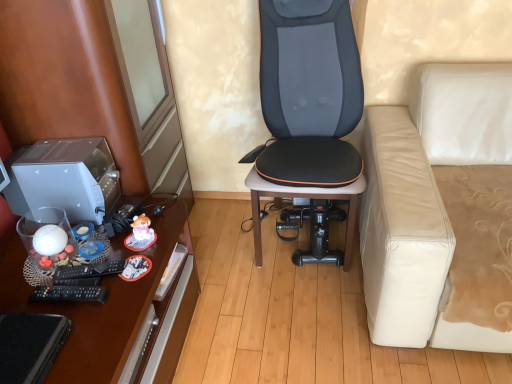
Measure the distance between brown wooden desk at left and camera.

The distance of brown wooden desk at left from camera is 1.01 meters.

Measure the distance between point (156, 333) and camera.

Point (156, 333) is 1.35 meters away from camera.

Measure the distance between brown wood dresser at left and camera.

brown wood dresser at left is 1.01 meters away from camera.

Locate an element on the screen. This screenshot has height=384, width=512. white leather couch at right is located at coordinates (426, 200).

This screenshot has width=512, height=384. What do you see at coordinates (426, 200) in the screenshot? I see `white leather couch at right` at bounding box center [426, 200].

I want to click on satin silver desktop at left, so click(x=65, y=178).

You are a GUI agent. You are given a task and a screenshot of the screen. Output one action in this format:
    pyautogui.click(x=<x>, y=<y>)
    Task: Click on the black leather chair at center
    
    Given the screenshot: What is the action you would take?
    pyautogui.click(x=309, y=116)

I want to click on brown wooden desk at left, so click(102, 305).

Consider the image. Is satin silver desktop at left facing away from brown wooden desk at left?

satin silver desktop at left is not turned away from brown wooden desk at left.

Is satin silver desktop at left next to brown wooden desk at left and touching it?

satin silver desktop at left and brown wooden desk at left are clearly separated.

Is satin silver desktop at left bigger or smaller than brown wooden desk at left?

Considering their sizes, satin silver desktop at left takes up less space than brown wooden desk at left.

Can you confirm if satin silver desktop at left is positioned to the left of brown wooden desk at left?

Correct, you'll find satin silver desktop at left to the left of brown wooden desk at left.

Is brown wood dresser at left looking in the opposite direction of brown wooden desk at left?

No, brown wooden desk at left is not at the back of brown wood dresser at left.

Between brown wood dresser at left and brown wooden desk at left, which one appears on the right side from the viewer's perspective?

brown wooden desk at left is more to the right.

Which of these two, brown wood dresser at left or brown wooden desk at left, stands shorter?

With less height is brown wooden desk at left.

Is brown wood dresser at left closer to the viewer compared to brown wooden desk at left?

That is False.

Does white leather couch at right appear on the left side of satin silver desktop at left?

Incorrect, white leather couch at right is not on the left side of satin silver desktop at left.

Is the position of white leather couch at right less distant than that of satin silver desktop at left?

Yes, white leather couch at right is in front of satin silver desktop at left.

You are a GUI agent. You are given a task and a screenshot of the screen. Output one action in this format:
    pyautogui.click(x=<x>, y=<y>)
    Task: Click on the desktop computer above the white leather couch at right (from the image's perspective)
    The height and width of the screenshot is (384, 512).
    Given the screenshot: What is the action you would take?
    coord(65,178)

Which object is wider, white leather couch at right or satin silver desktop at left?

With larger width is white leather couch at right.

Is brown wooden desk at left in front of or behind satin silver desktop at left in the image?

brown wooden desk at left is in front of satin silver desktop at left.

Based on the photo, how distant is brown wooden desk at left from satin silver desktop at left?

brown wooden desk at left is 10.54 inches away from satin silver desktop at left.

Is brown wooden desk at left at the left side of satin silver desktop at left?

No, brown wooden desk at left is not to the left of satin silver desktop at left.

Between brown wooden desk at left and satin silver desktop at left, which one has smaller size?

With smaller size is satin silver desktop at left.

Is black leather chair at center inside the boundaries of brown wooden desk at left, or outside?

black leather chair at center is spatially situated outside brown wooden desk at left.

Considering the relative sizes of black leather chair at center and brown wooden desk at left in the image provided, is black leather chair at center smaller than brown wooden desk at left?

Yes, black leather chair at center is smaller than brown wooden desk at left.

From a real-world perspective, which object rests below the other?

brown wooden desk at left.

Does satin silver desktop at left touch brown wood dresser at left?

No, satin silver desktop at left is not with brown wood dresser at left.

Considering the sizes of satin silver desktop at left and brown wood dresser at left in the image, is satin silver desktop at left taller or shorter than brown wood dresser at left?

Clearly, satin silver desktop at left is shorter compared to brown wood dresser at left.

Between satin silver desktop at left and brown wood dresser at left, which one has smaller size?

Smaller between the two is satin silver desktop at left.

The image size is (512, 384). In the image, there is a satin silver desktop at left. Find the location of `dresser below it (from a real-world perspective)`. dresser below it (from a real-world perspective) is located at coordinates (66, 81).

Consider the image. Can you confirm if white leather couch at right is taller than black leather chair at center?

No, white leather couch at right is not taller than black leather chair at center.

From the picture: Considering the relative sizes of white leather couch at right and black leather chair at center in the image provided, is white leather couch at right smaller than black leather chair at center?

Actually, white leather couch at right might be larger than black leather chair at center.

Which of these two, white leather couch at right or black leather chair at center, is wider?

Wider between the two is white leather couch at right.

Is white leather couch at right facing away from black leather chair at center?

No, white leather couch at right's orientation is not away from black leather chair at center.

Locate an element on the screen. desk that is in front of the satin silver desktop at left is located at coordinates (102, 305).

What are the coordinates of `desk on the right of brown wood dresser at left` in the screenshot? It's located at (102, 305).

Based on their spatial positions, is brown wooden desk at left or white leather couch at right closer to black leather chair at center?

white leather couch at right lies closer to black leather chair at center than the other object.

Which object lies nearer to the anchor point white leather couch at right, satin silver desktop at left or black leather chair at center?

Among the two, black leather chair at center is located nearer to white leather couch at right.

Considering their positions, is satin silver desktop at left positioned closer to brown wood dresser at left than black leather chair at center?

Based on the image, satin silver desktop at left appears to be nearer to brown wood dresser at left.

Considering their positions, is brown wood dresser at left positioned closer to satin silver desktop at left than brown wooden desk at left?

brown wood dresser at left is closer to satin silver desktop at left.

When comparing their distances from black leather chair at center, does brown wooden desk at left or satin silver desktop at left seem closer?

Based on the image, brown wooden desk at left appears to be nearer to black leather chair at center.

Looking at the image, which one is located further to white leather couch at right, brown wood dresser at left or black leather chair at center?

brown wood dresser at left lies further to white leather couch at right than the other object.

Looking at the image, which one is located closer to brown wood dresser at left, black leather chair at center or white leather couch at right?

black leather chair at center.

Consider the image. Considering their positions, is satin silver desktop at left positioned further to white leather couch at right than brown wood dresser at left?

satin silver desktop at left.

Locate an element on the screen. This screenshot has height=384, width=512. chair located between brown wood dresser at left and white leather couch at right in the left-right direction is located at coordinates (309, 116).

At what (x,y) coordinates should I click in order to perform the action: click on desk situated between brown wood dresser at left and white leather couch at right from left to right. Please return your answer as a coordinate pair (x, y). The height and width of the screenshot is (384, 512). Looking at the image, I should click on (102, 305).

Image resolution: width=512 pixels, height=384 pixels. I want to click on dresser located between satin silver desktop at left and black leather chair at center in the left-right direction, so click(x=66, y=81).

Locate an element on the screen. The width and height of the screenshot is (512, 384). chair between satin silver desktop at left and white leather couch at right is located at coordinates (309, 116).